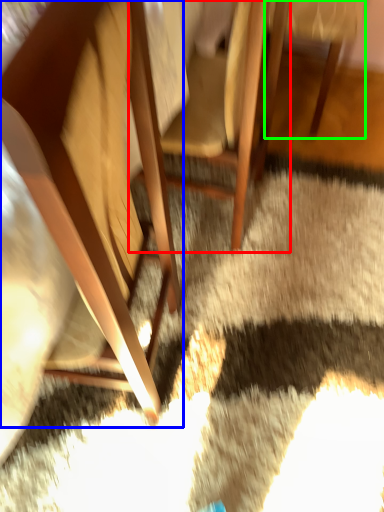
Question: Based on their relative distances, which object is nearer to chair (highlighted by a red box)? Choose from chair (highlighted by a blue box) and chair (highlighted by a green box).

Choices:
 (A) chair
 (B) chair

Answer: (B)